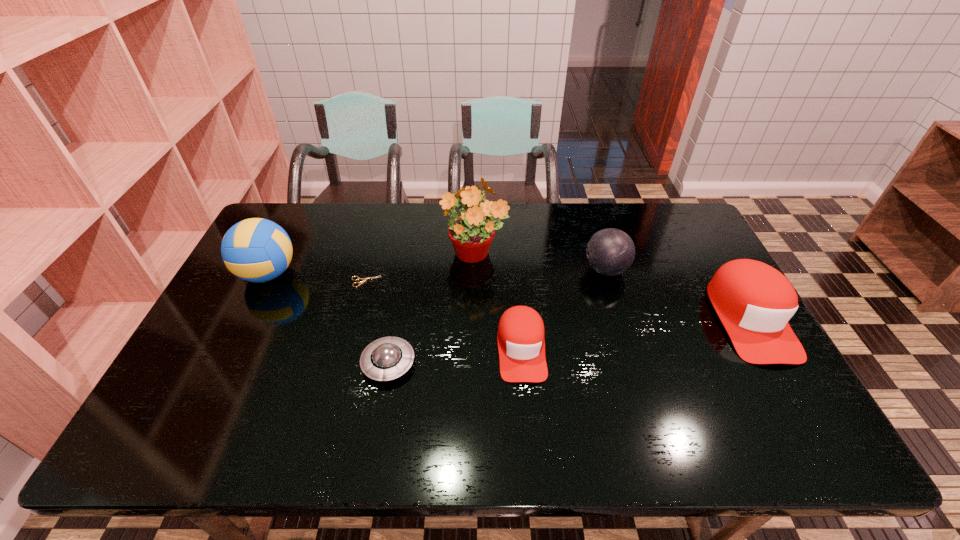
Identify the location of free space that satisfies the following two spatial constraints: 1. on the grip area of the bowling ball; 2. on the front side of the shears. This screenshot has height=540, width=960. (610, 281).